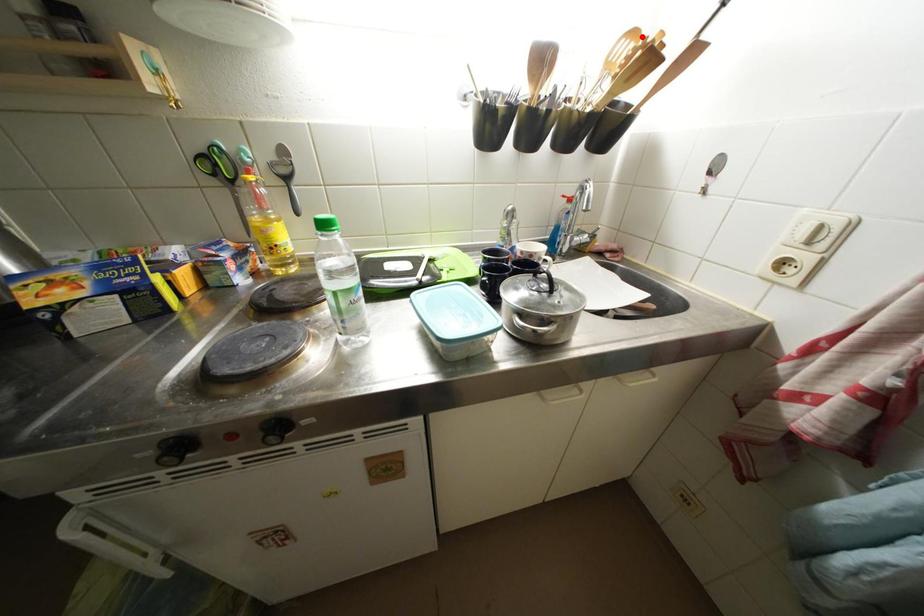
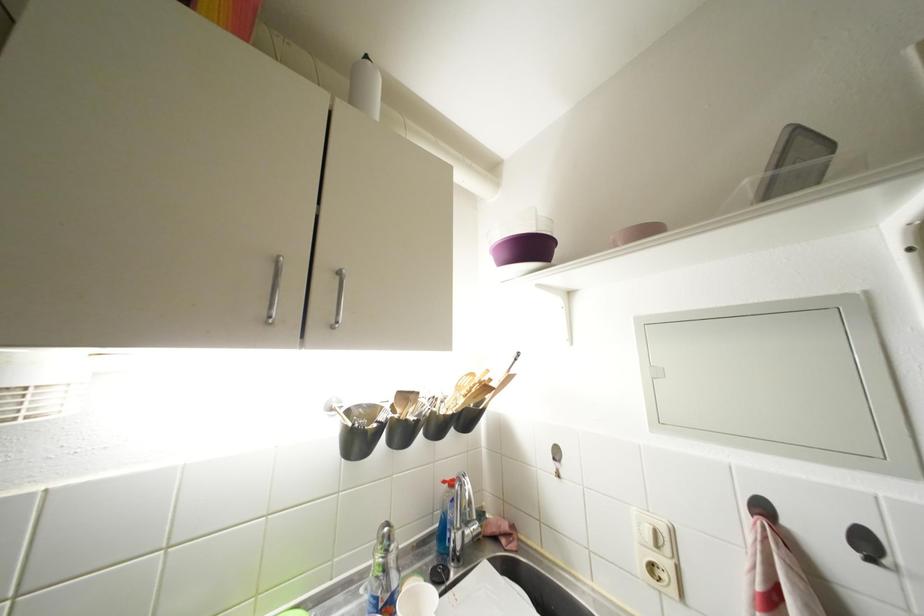
Where in the second image is the point corresponding to the highlighted location from the first image?

(479, 379)